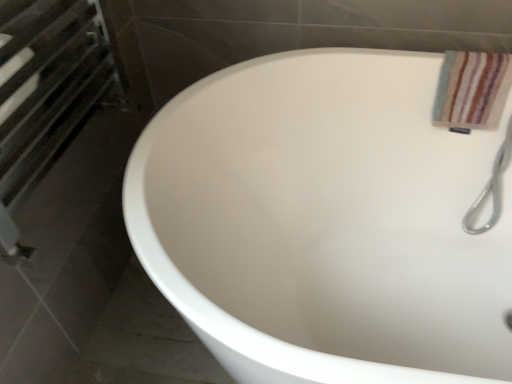
Where is `white glossy bathtub at center`? white glossy bathtub at center is located at coordinates (325, 222).

Considering the relative sizes of matte metal towel rack at left and white glossy bathtub at center in the image provided, is matte metal towel rack at left shorter than white glossy bathtub at center?

Yes, matte metal towel rack at left is shorter than white glossy bathtub at center.

Which of these two, matte metal towel rack at left or white glossy bathtub at center, is bigger?

With larger size is white glossy bathtub at center.

Is white glossy bathtub at center at the back of matte metal towel rack at left?

matte metal towel rack at left is not turned away from white glossy bathtub at center.

From a real-world perspective, relative to white glossy bathtub at center, is matte metal towel rack at left vertically above or below?

In terms of real-world spatial position, matte metal towel rack at left is above white glossy bathtub at center.

Which of these two, matte metal towel rack at left or striped cotton towel at upper right, is thinner?

matte metal towel rack at left is thinner.

Does matte metal towel rack at left have a larger size compared to striped cotton towel at upper right?

Correct, matte metal towel rack at left is larger in size than striped cotton towel at upper right.

Is matte metal towel rack at left completely or partially outside of striped cotton towel at upper right?

Yes, matte metal towel rack at left is outside of striped cotton towel at upper right.

Is white glossy bathtub at center spatially inside matte metal towel rack at left, or outside of it?

white glossy bathtub at center is located beyond the bounds of matte metal towel rack at left.

The width and height of the screenshot is (512, 384). I want to click on screen door positioned vertically above the white glossy bathtub at center (from a real-world perspective), so click(44, 93).

Considering the relative sizes of white glossy bathtub at center and matte metal towel rack at left in the image provided, is white glossy bathtub at center taller than matte metal towel rack at left?

Correct, white glossy bathtub at center is much taller as matte metal towel rack at left.

From a real-world perspective, does white glossy bathtub at center sit lower than matte metal towel rack at left?

Yes, from a real-world perspective, white glossy bathtub at center is under matte metal towel rack at left.

Looking at this image, considering the relative sizes of striped cotton towel at upper right and white glossy bathtub at center in the image provided, is striped cotton towel at upper right bigger than white glossy bathtub at center?

No.

Which of these two, striped cotton towel at upper right or white glossy bathtub at center, stands shorter?

Standing shorter between the two is striped cotton towel at upper right.

From a real-world perspective, who is located lower, striped cotton towel at upper right or white glossy bathtub at center?

white glossy bathtub at center, from a real-world perspective.

Which object is closer to the camera taking this photo, striped cotton towel at upper right or white glossy bathtub at center?

white glossy bathtub at center.

Is striped cotton towel at upper right far away from matte metal towel rack at left?

They are positioned close to each other.

Is matte metal towel rack at left at the back of striped cotton towel at upper right?

That's not correct — striped cotton towel at upper right is not looking away from matte metal towel rack at left.

From the image's perspective, which one is positioned lower, striped cotton towel at upper right or matte metal towel rack at left?

From the image's view, matte metal towel rack at left is below.

Can you tell me how much white glossy bathtub at center and striped cotton towel at upper right differ in facing direction?

white glossy bathtub at center and striped cotton towel at upper right are facing 0.00112 degrees away from each other.

Considering the positions of objects white glossy bathtub at center and striped cotton towel at upper right in the image provided, who is in front, white glossy bathtub at center or striped cotton towel at upper right?

white glossy bathtub at center is closer to the camera.

Can you confirm if white glossy bathtub at center is wider than striped cotton towel at upper right?

Yes.

From the image's perspective, is white glossy bathtub at center located above or below striped cotton towel at upper right?

white glossy bathtub at center is situated lower than striped cotton towel at upper right in the image.

Locate an element on the screen. The image size is (512, 384). bathtub in front of the matte metal towel rack at left is located at coordinates (325, 222).

The image size is (512, 384). I want to click on screen door to the left of striped cotton towel at upper right, so click(x=44, y=93).

Consider the image. Considering their positions, is white glossy bathtub at center positioned closer to striped cotton towel at upper right than matte metal towel rack at left?

white glossy bathtub at center is closer to striped cotton towel at upper right.

Considering their positions, is striped cotton towel at upper right positioned closer to matte metal towel rack at left than white glossy bathtub at center?

The object closer to matte metal towel rack at left is white glossy bathtub at center.

Considering their positions, is white glossy bathtub at center positioned closer to matte metal towel rack at left than striped cotton towel at upper right?

white glossy bathtub at center is positioned closer to the anchor matte metal towel rack at left.

Estimate the real-world distances between objects in this image. Which object is closer to white glossy bathtub at center, matte metal towel rack at left or striped cotton towel at upper right?

The object closer to white glossy bathtub at center is striped cotton towel at upper right.

Which object lies nearer to the anchor point striped cotton towel at upper right, matte metal towel rack at left or white glossy bathtub at center?

white glossy bathtub at center is positioned closer to the anchor striped cotton towel at upper right.

Based on their spatial positions, is striped cotton towel at upper right or matte metal towel rack at left closer to white glossy bathtub at center?

striped cotton towel at upper right is positioned closer to the anchor white glossy bathtub at center.

Where is `bathtub situated between matte metal towel rack at left and striped cotton towel at upper right from left to right`? Image resolution: width=512 pixels, height=384 pixels. bathtub situated between matte metal towel rack at left and striped cotton towel at upper right from left to right is located at coordinates (325, 222).